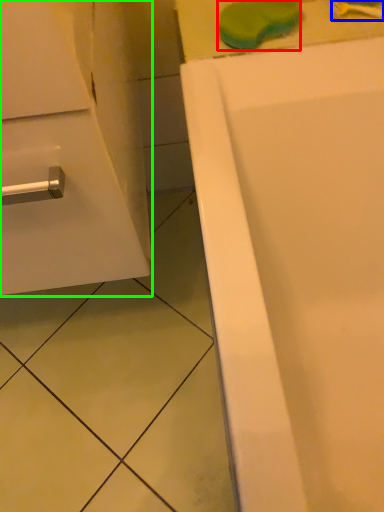
Question: Which object is the farthest from soap (highlighted by a red box)? Choose among these: toothbrush (highlighted by a blue box) or bathroom cabinet (highlighted by a green box).

Choices:
 (A) toothbrush
 (B) bathroom cabinet

Answer: (B)